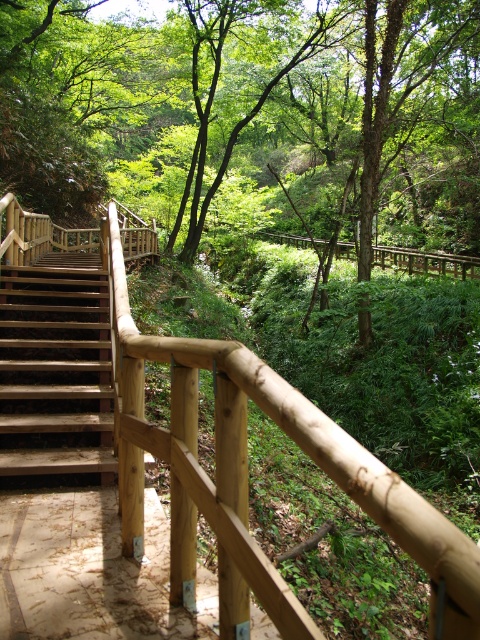
You are a hiker trying to navigate through the forest. You see a green matte tree at upper center and a brown wooden path at lower left. Which object is taller?

The green matte tree at upper center is taller than the brown wooden path at lower left according to the description.

You are a painter who needs to decide which object to paint first between the natural wood handrail at center and the wooden stairs at left. Since you want to paint the smaller object first, which one should you choose?

The natural wood handrail at center is smaller than the wooden stairs at left, so you should paint the natural wood handrail at center first.